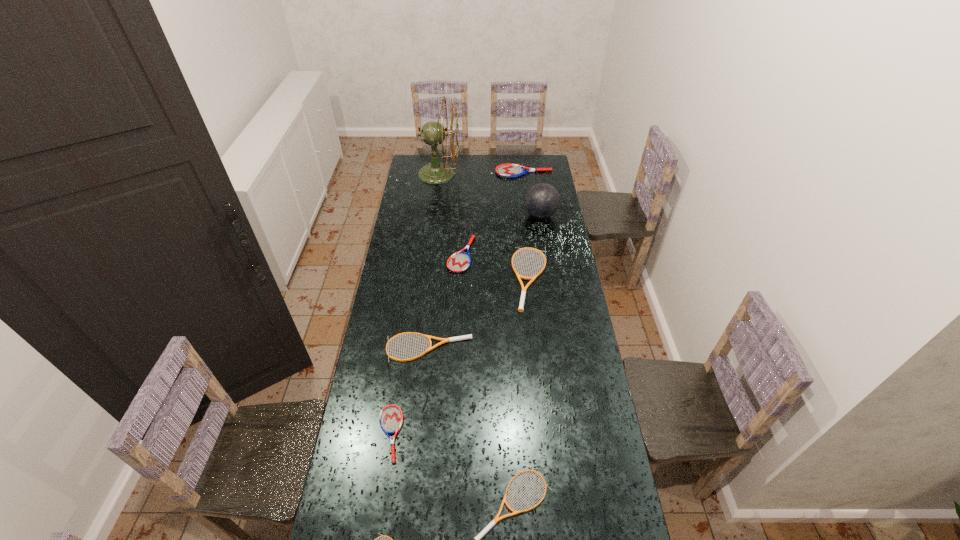
Identify which beige tennis racket is located as the second nearest to the third farthest object. Please provide its 2D coordinates. Your answer should be formatted as a tuple, i.e. [(x, y)], where the tuple contains the x and y coordinates of a point satisfying the conditions above.

[(443, 340)]

Where is `the second closest beige tennis racket to the biggest beige tennis racket`? The image size is (960, 540). the second closest beige tennis racket to the biggest beige tennis racket is located at coordinates (477, 539).

Identify which blue tennis racket is located as the nearest to the second blue tennis racket from left to right. Please provide its 2D coordinates. Your answer should be formatted as a tuple, i.e. [(x, y)], where the tuple contains the x and y coordinates of a point satisfying the conditions above.

[(504, 170)]

This screenshot has width=960, height=540. I want to click on blue tennis racket that stands as the second closest to the second biggest beige tennis racket, so click(x=460, y=261).

This screenshot has height=540, width=960. I want to click on vacant space that satisfies the following two spatial constraints: 1. on the back side of the second nearest blue tennis racket; 2. in front of the fan, directing air flow, so click(x=465, y=174).

Where is `vacant region that satisfies the following two spatial constraints: 1. in front of the tallest object, directing air flow; 2. on the right side of the second biggest blue tennis racket`? vacant region that satisfies the following two spatial constraints: 1. in front of the tallest object, directing air flow; 2. on the right side of the second biggest blue tennis racket is located at coordinates (428, 254).